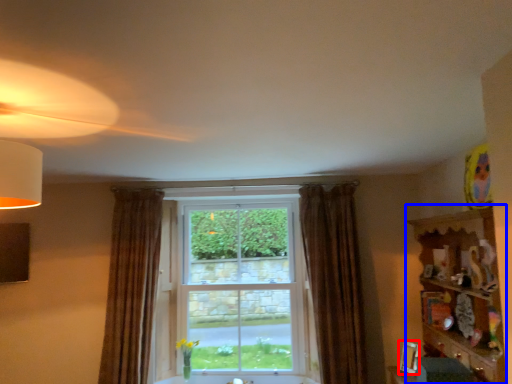
Question: Which object is closer to the camera taking this photo, picture frame (highlighted by a red box) or dresser (highlighted by a blue box)?

Choices:
 (A) picture frame
 (B) dresser

Answer: (B)